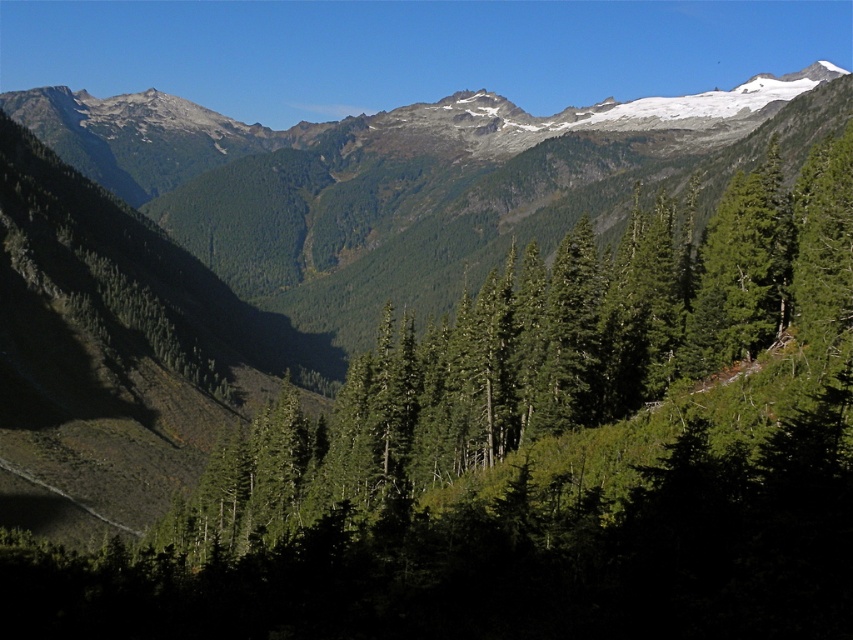
Question: Does green textured tree at center have a smaller size compared to green textured mountains at upper center?

Choices:
 (A) yes
 (B) no

Answer: (A)

Question: Does green textured tree at center appear over green textured mountains at upper center?

Choices:
 (A) no
 (B) yes

Answer: (A)

Question: Does green textured tree at center appear on the left side of green textured mountains at upper center?

Choices:
 (A) no
 (B) yes

Answer: (A)

Question: Which object is farther from the camera taking this photo?

Choices:
 (A) green textured mountains at upper center
 (B) green textured tree at center

Answer: (A)

Question: Which point is farther to the camera?

Choices:
 (A) green textured mountains at upper center
 (B) green textured tree at center

Answer: (A)